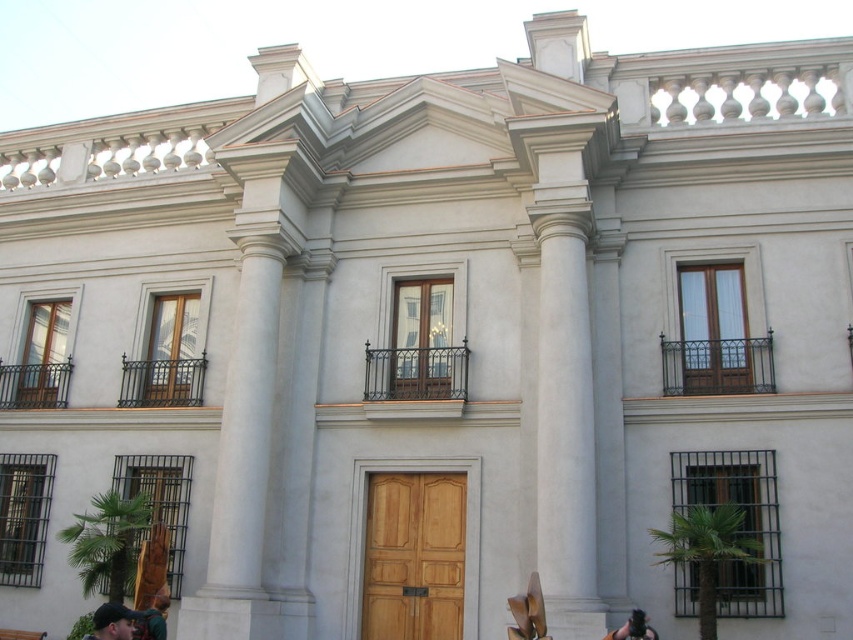
You are standing in front of the classical building and notice two points marked on the facade. The first point is at coordinate point (129, 632) and the second is at point (654, 637). Which point is closer to your current position?

Point (129, 632) is closer to the camera than point (654, 637), so the first point is closer to your current position.